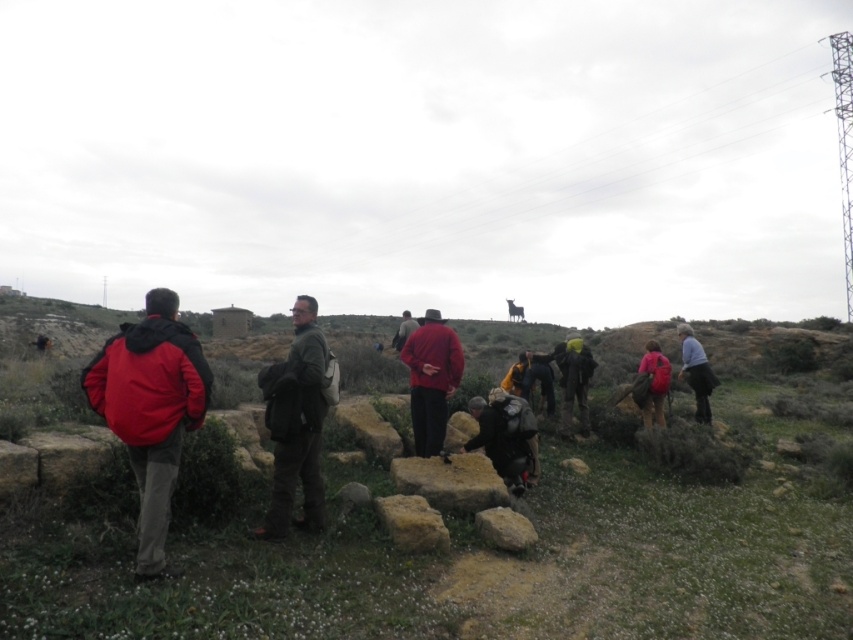
You are a photographer trying to capture a photo of the red matte jacket at left and the dark gray backpack at center. Based on their positions, which object should you focus on first to ensure both are in the frame?

The red matte jacket at left is above the dark gray backpack at center, so you should focus on the dark gray backpack at center first to ensure both are in the frame.